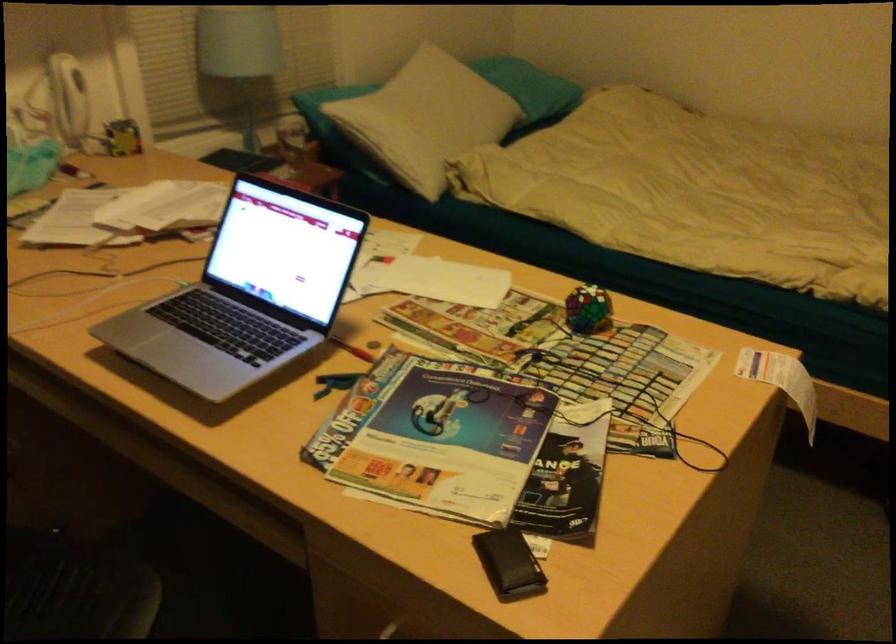
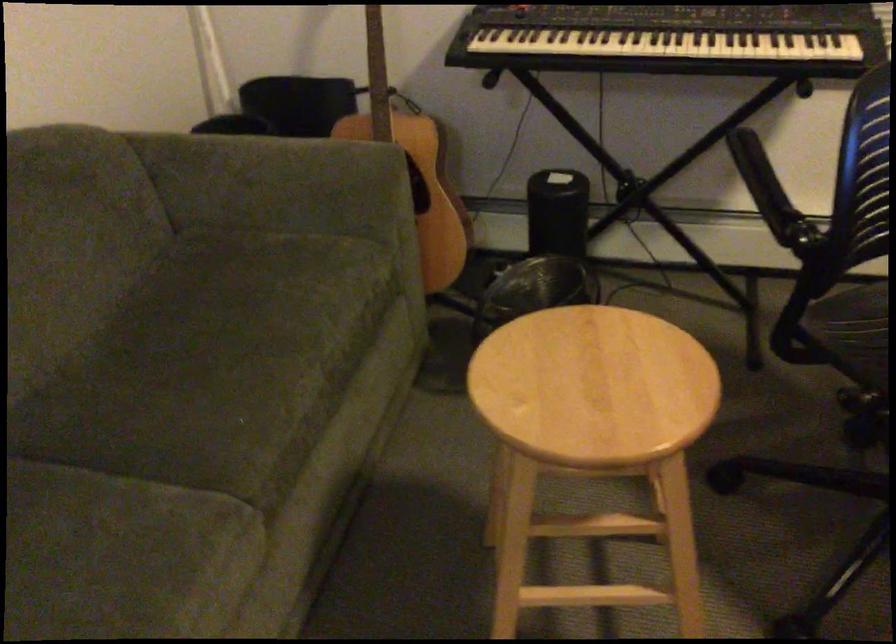
Based on the continuous images, in which direction is the camera rotating?

The rotation direction of the camera is left-down.